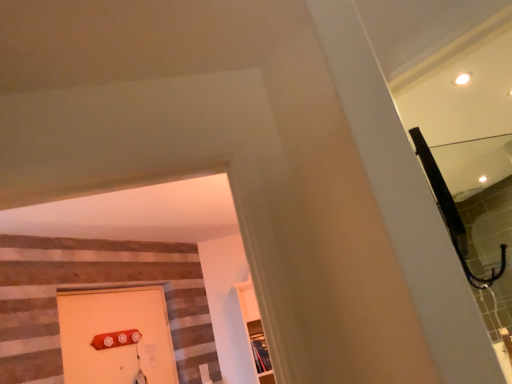
Question: Is wooden shelf at center aimed at clear glass mirror at upper right?

Choices:
 (A) no
 (B) yes

Answer: (B)

Question: From the image's perspective, is wooden shelf at center located beneath clear glass mirror at upper right?

Choices:
 (A) yes
 (B) no

Answer: (A)

Question: Is wooden shelf at center taller than clear glass mirror at upper right?

Choices:
 (A) yes
 (B) no

Answer: (A)

Question: Is clear glass mirror at upper right completely or partially inside wooden shelf at center?

Choices:
 (A) no
 (B) yes

Answer: (A)

Question: Considering the relative sizes of wooden shelf at center and clear glass mirror at upper right in the image provided, is wooden shelf at center wider than clear glass mirror at upper right?

Choices:
 (A) no
 (B) yes

Answer: (B)

Question: From a real-world perspective, is wooden shelf at center over clear glass mirror at upper right?

Choices:
 (A) no
 (B) yes

Answer: (A)

Question: Can you confirm if matte orange door at lower left is taller than clear glass mirror at upper right?

Choices:
 (A) no
 (B) yes

Answer: (B)

Question: Is matte orange door at lower left further to camera compared to clear glass mirror at upper right?

Choices:
 (A) yes
 (B) no

Answer: (A)

Question: Considering the relative sizes of matte orange door at lower left and clear glass mirror at upper right in the image provided, is matte orange door at lower left shorter than clear glass mirror at upper right?

Choices:
 (A) no
 (B) yes

Answer: (A)

Question: From a real-world perspective, does matte orange door at lower left stand above clear glass mirror at upper right?

Choices:
 (A) yes
 (B) no

Answer: (A)

Question: Does matte orange door at lower left have a smaller size compared to clear glass mirror at upper right?

Choices:
 (A) yes
 (B) no

Answer: (B)

Question: From a real-world perspective, is matte orange door at lower left physically below clear glass mirror at upper right?

Choices:
 (A) yes
 (B) no

Answer: (B)

Question: Is the position of wooden shelf at center more distant than that of matte orange door at lower left?

Choices:
 (A) no
 (B) yes

Answer: (B)